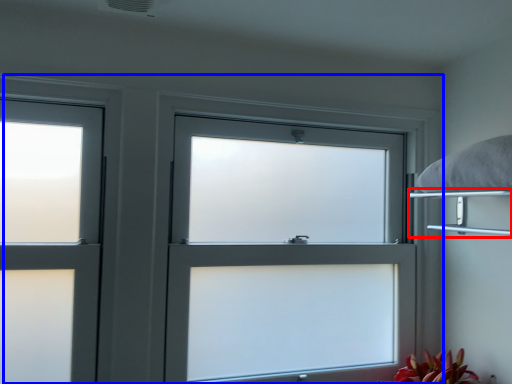
Question: Among these objects, which one is nearest to the camera, shelf (highlighted by a red box) or window (highlighted by a blue box)?

Choices:
 (A) shelf
 (B) window

Answer: (A)